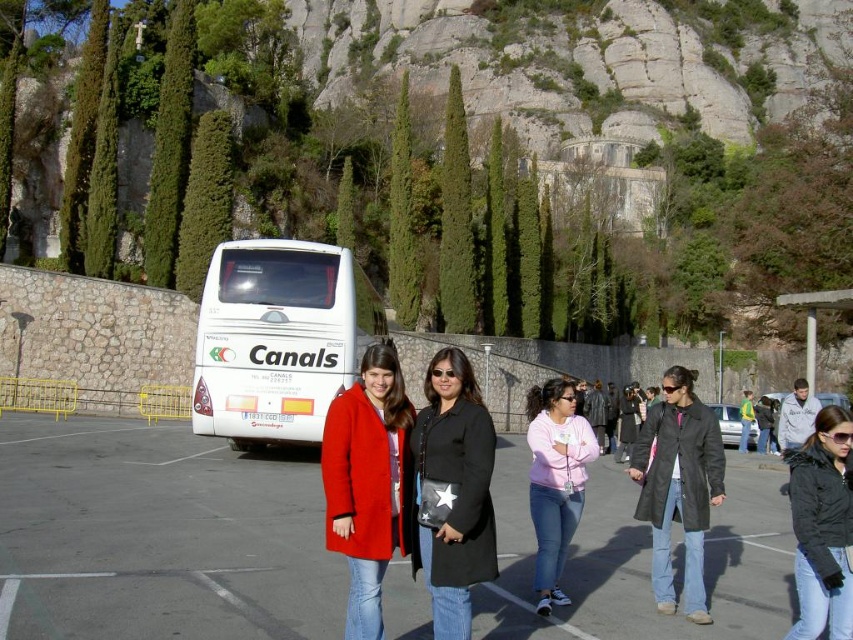
You are a photographer trying to capture a photo of the two women without any vehicles in the background. Given that you can only move left or right, which direction should you move to avoid the white glossy bus at upper left and the white matte bus at left?

You should move to the right to avoid the white glossy bus at upper left and the white matte bus at left because the white glossy bus at upper left is in front of the white matte bus at left, so moving right might position you behind both buses or between them where they are not obstructing the view.

You are a photographer trying to capture both the matte red coat at center and the black leather jacket at center in a single frame. The camera you are using has a lens that can only accommodate objects up to 1.2 meters in width between them. Based on their positions, will both subjects fit within the camera frame?

The matte red coat at center might be wider than black leather jacket at center, but since the maximum width the camera can accommodate is 1.2 meters, it is uncertain if they will fit without knowing the exact width difference between them.

You are a photographer trying to capture a photo of the two women in front of the white matte bus at left and the black matte jacket at lower right. Since the bus and jacket are different sizes, which object should you position closer to the camera to make them appear the same size in the photo?

To make the white matte bus at left and the black matte jacket at lower right appear the same size in the photo, position the smaller black matte jacket at lower right closer to the camera since the white matte bus at left is larger and needs to be farther away to balance their sizes.